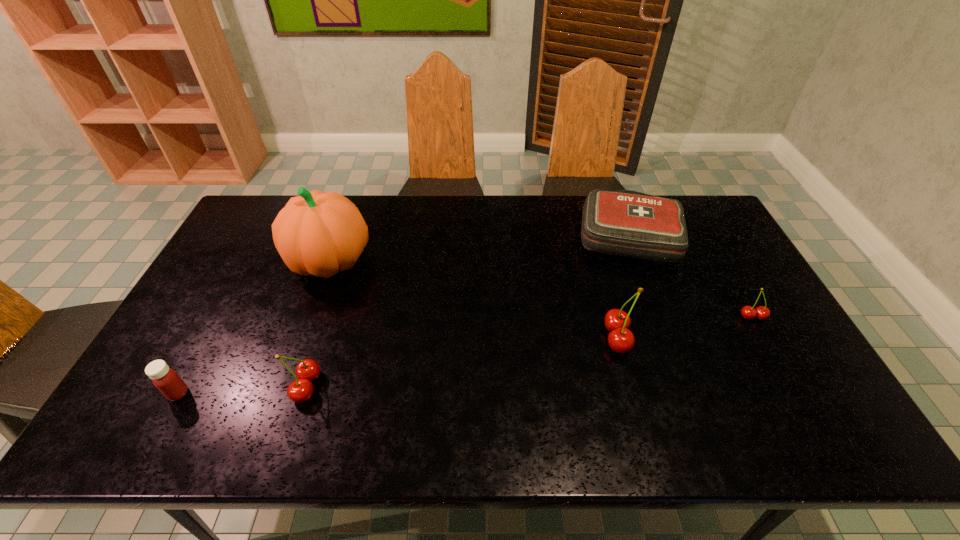
Find the location of a particular element. object that is at the left edge is located at coordinates (166, 380).

The width and height of the screenshot is (960, 540). Identify the location of cherry at the right edge. (748, 312).

Where is `the first-aid kit that is at the right edge`? The height and width of the screenshot is (540, 960). the first-aid kit that is at the right edge is located at coordinates (627, 223).

Where is `object located at the near left corner`? The height and width of the screenshot is (540, 960). object located at the near left corner is located at coordinates tap(166, 380).

I want to click on object present at the far right corner, so click(627, 223).

The width and height of the screenshot is (960, 540). I want to click on vacant region at the far edge of the desktop, so click(573, 213).

You are a GUI agent. You are given a task and a screenshot of the screen. Output one action in this format:
    pyautogui.click(x=<x>, y=<y>)
    Task: Click on the free space at the near edge of the desktop
    The height and width of the screenshot is (540, 960).
    Given the screenshot: What is the action you would take?
    pyautogui.click(x=585, y=375)

Find the location of a particular element. This screenshot has height=540, width=960. vacant space at the left edge is located at coordinates (251, 287).

You are a GUI agent. You are given a task and a screenshot of the screen. Output one action in this format:
    pyautogui.click(x=<x>, y=<y>)
    Task: Click on the vacant area at the far right corner
    The height and width of the screenshot is (540, 960).
    Given the screenshot: What is the action you would take?
    pyautogui.click(x=684, y=204)

You are a GUI agent. You are given a task and a screenshot of the screen. Output one action in this format:
    pyautogui.click(x=<x>, y=<y>)
    Task: Click on the empty space between the first-aid kit and the medicine
    Image resolution: width=960 pixels, height=540 pixels.
    Given the screenshot: What is the action you would take?
    pyautogui.click(x=404, y=314)